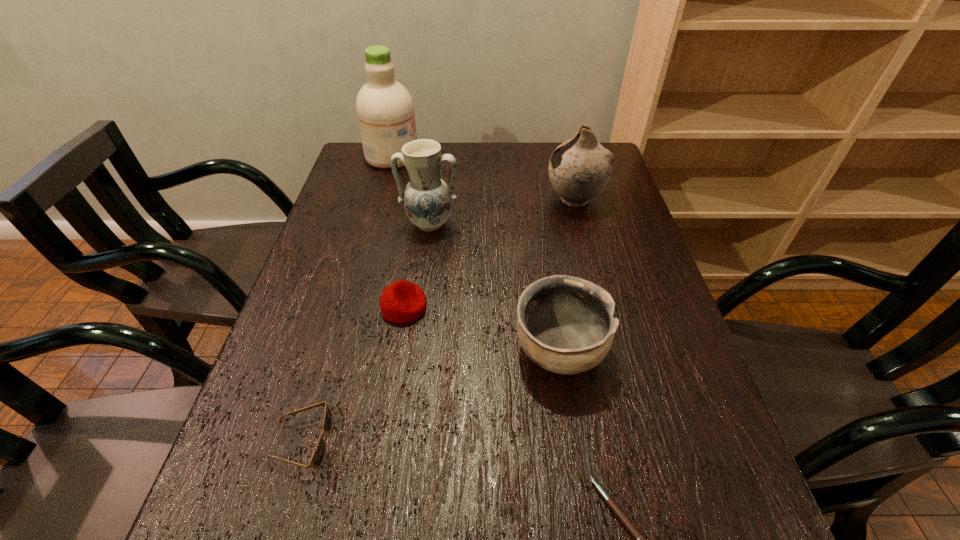
Where is `vacant space that satisfies the following two spatial constraints: 1. on either side of the nearest pottery; 2. on the right side of the leftmost pottery`? The width and height of the screenshot is (960, 540). vacant space that satisfies the following two spatial constraints: 1. on either side of the nearest pottery; 2. on the right side of the leftmost pottery is located at coordinates (413, 350).

This screenshot has width=960, height=540. What are the coordinates of `blank area in the image that satisfies the following two spatial constraints: 1. on the front label of the nearest pottery; 2. on the left side of the tallest object` in the screenshot? It's located at (339, 350).